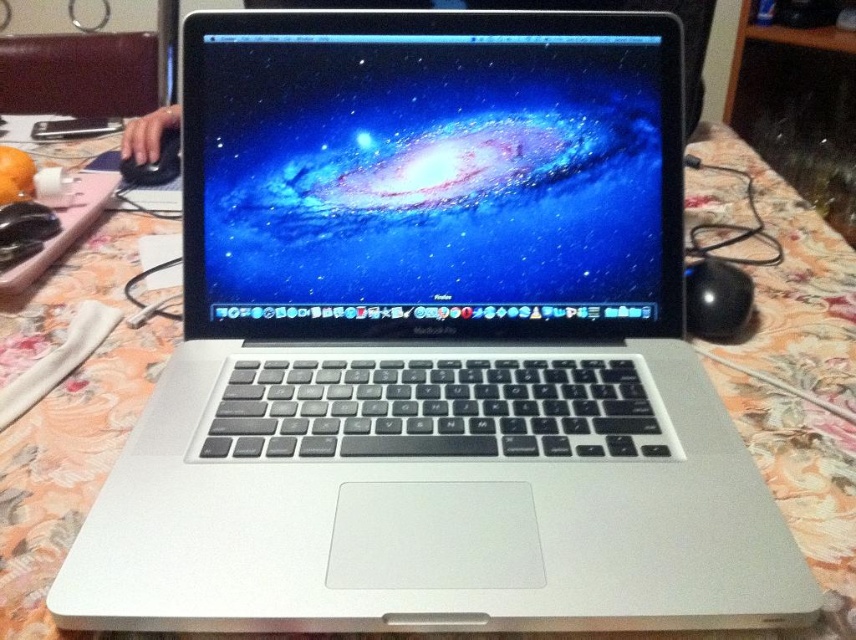
Question: Among these points, which one is nearest to the camera?

Choices:
 (A) (21, 88)
 (B) (177, 163)

Answer: (B)

Question: Among these objects, which one is farthest from the camera?

Choices:
 (A) brown leather couch at upper left
 (B) black matte mouse at left

Answer: (A)

Question: Does brown leather couch at upper left have a larger size compared to black matte mouse at left?

Choices:
 (A) yes
 (B) no

Answer: (A)

Question: Is brown leather couch at upper left smaller than black matte mouse at left?

Choices:
 (A) yes
 (B) no

Answer: (B)

Question: Observing the image, what is the correct spatial positioning of brown leather couch at upper left in reference to black matte mouse at left?

Choices:
 (A) below
 (B) above

Answer: (B)

Question: Which point is farther to the camera?

Choices:
 (A) (177, 172)
 (B) (27, 74)

Answer: (B)